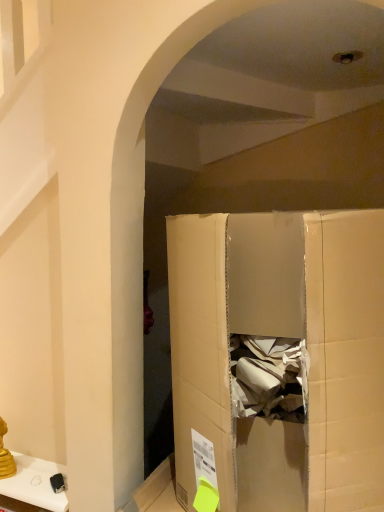
Question: Considering the relative sizes of metallic gold candlestick at lower left and cardboard box at center in the image provided, is metallic gold candlestick at lower left smaller than cardboard box at center?

Choices:
 (A) no
 (B) yes

Answer: (B)

Question: From a real-world perspective, does metallic gold candlestick at lower left stand above cardboard box at center?

Choices:
 (A) yes
 (B) no

Answer: (B)

Question: Is metallic gold candlestick at lower left at the left side of cardboard box at center?

Choices:
 (A) yes
 (B) no

Answer: (A)

Question: Is metallic gold candlestick at lower left far away from cardboard box at center?

Choices:
 (A) yes
 (B) no

Answer: (B)

Question: From a real-world perspective, is metallic gold candlestick at lower left below cardboard box at center?

Choices:
 (A) yes
 (B) no

Answer: (A)

Question: Does metallic gold candlestick at lower left contain cardboard box at center?

Choices:
 (A) no
 (B) yes

Answer: (A)

Question: From a real-world perspective, is cardboard box at center on metallic gold candlestick at lower left?

Choices:
 (A) no
 (B) yes

Answer: (B)

Question: Is metallic gold candlestick at lower left located within cardboard box at center?

Choices:
 (A) no
 (B) yes

Answer: (A)

Question: Does cardboard box at center appear on the right side of metallic gold candlestick at lower left?

Choices:
 (A) yes
 (B) no

Answer: (A)

Question: Can you confirm if cardboard box at center is smaller than metallic gold candlestick at lower left?

Choices:
 (A) yes
 (B) no

Answer: (B)

Question: From the image's perspective, is cardboard box at center located beneath metallic gold candlestick at lower left?

Choices:
 (A) no
 (B) yes

Answer: (A)

Question: Considering the relative sizes of cardboard box at center and metallic gold candlestick at lower left in the image provided, is cardboard box at center thinner than metallic gold candlestick at lower left?

Choices:
 (A) yes
 (B) no

Answer: (B)

Question: Visually, is cardboard box at center positioned to the left or to the right of metallic gold candlestick at lower left?

Choices:
 (A) right
 (B) left

Answer: (A)